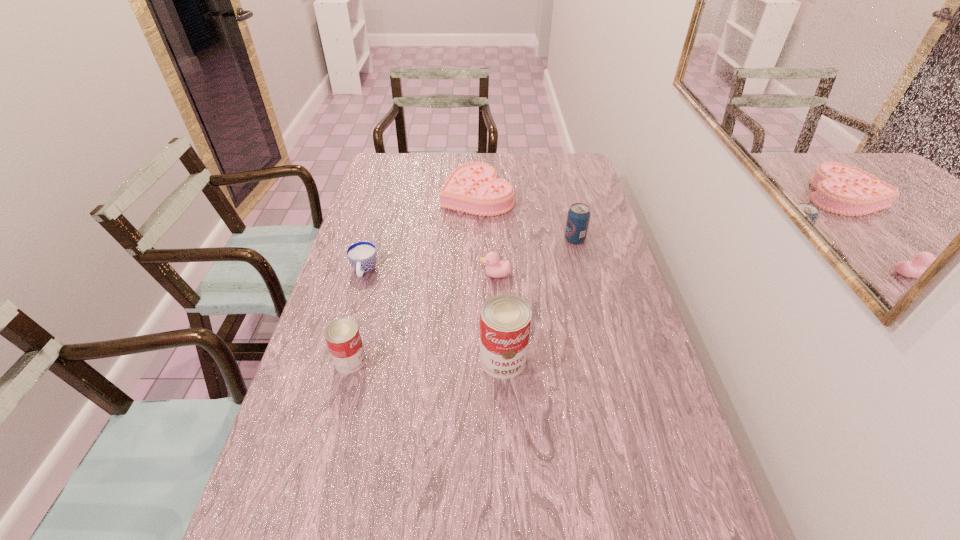
This screenshot has height=540, width=960. In order to click on unoccupied area between the left can and the rightmost object in this screenshot , I will do `click(463, 300)`.

What are the coordinates of `empty location between the cake and the cup` in the screenshot? It's located at (420, 233).

Where is `free space between the rightmost object and the duckling`? free space between the rightmost object and the duckling is located at coordinates (536, 257).

What are the coordinates of `free space between the cup and the farthest object` in the screenshot? It's located at (420, 233).

The height and width of the screenshot is (540, 960). I want to click on vacant region between the tallest object and the cup, so click(434, 315).

Where is `object that is the fifth closest to the cup`? This screenshot has height=540, width=960. object that is the fifth closest to the cup is located at coordinates (578, 217).

Select which object appears as the fifth closest to the duckling. Please provide its 2D coordinates. Your answer should be formatted as a tuple, i.e. [(x, y)], where the tuple contains the x and y coordinates of a point satisfying the conditions above.

[(342, 336)]

This screenshot has height=540, width=960. Identify the location of free spot that satisfies the following two spatial constraints: 1. on the front label of the tallest object; 2. on the front label of the shorter can. (503, 361).